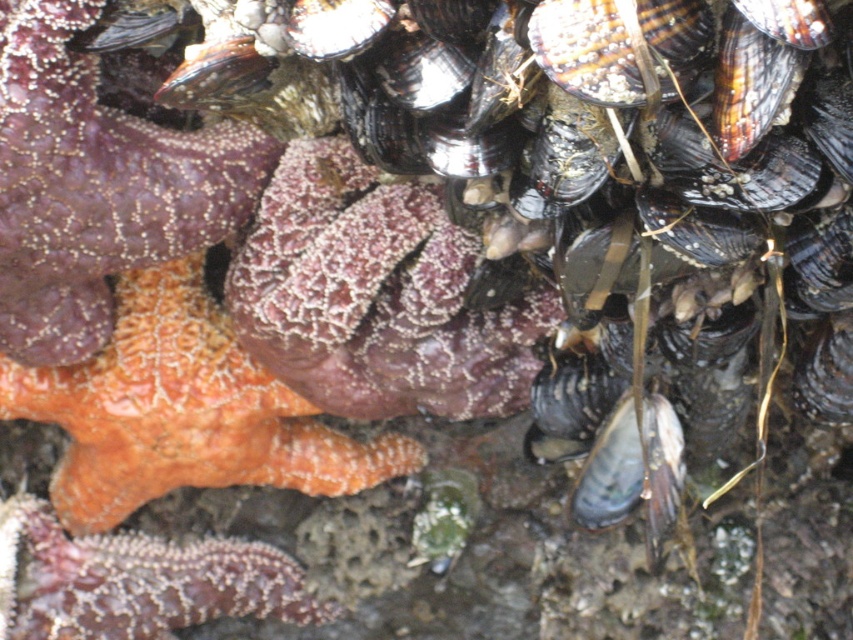
You are a marine biologist observing this tide pool. You need to place a 10 cm wide measurement tool between the orange rough starfish at upper left and the orange sponge at center. Based on their sizes, can the tool fit between them without overlapping either object?

The orange rough starfish at upper left has a lesser width compared to the orange sponge at center. Since the sponge is wider, there might be enough space between them for the 10 cm tool, but the exact distance isn

You are a marine biologist measuring distances between marine organisms in a tide pool. You need to place a 6.5 inch ruler between the orange sponge at center and the orange textured starfish at lower left. Will the ruler fit entirely between them without overlapping either organism?

The distance between the orange sponge at center and the orange textured starfish at lower left is 5.92 inches. Since the ruler is 6.5 inches long, it will be 0.58 inches too long to fit entirely between them without overlapping either organism.